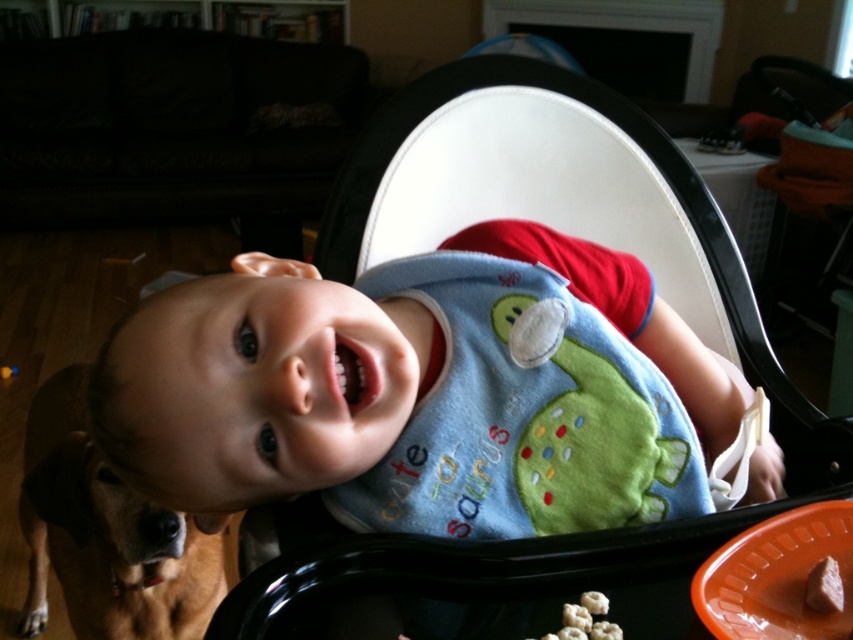
You are a parent looking at the scene. You want to place a toy on the table so it is visible to the baby in the black plastic highchair at center. Where should you place the toy relative to the brown matte cookie at lower right?

The black plastic highchair at center is above the brown matte cookie at lower right, so placing the toy above the brown matte cookie at lower right would make it visible to the baby in the highchair.

You are a parent trying to place the brown matte cookie at lower right onto the tray of the black plastic highchair at center. Considering their sizes, will the cookie fit comfortably on the tray?

The black plastic highchair at center has a larger size compared to the brown matte cookie at lower right, so the cookie will fit comfortably on the tray.

Please look at the image and identify which object corresponds to the coordinates point (x=585, y=620). The options are the white fluffy popcorn at lower center and the baby in the black high chair. Your answer should be one of the two options.

The white fluffy popcorn at lower center corresponds to the coordinates point (x=585, y=620).